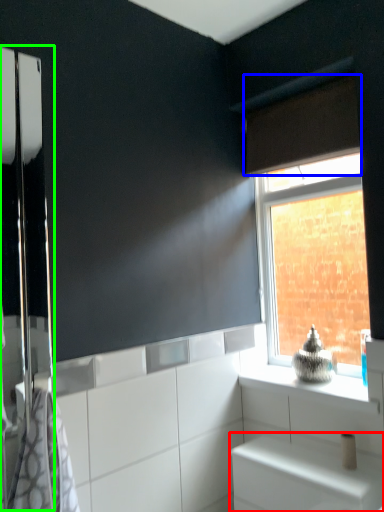
Question: Which object is positioned closest to cabinetry (highlighted by a red box)? Select from curtain (highlighted by a blue box) and screen door (highlighted by a green box).

Choices:
 (A) curtain
 (B) screen door

Answer: (B)